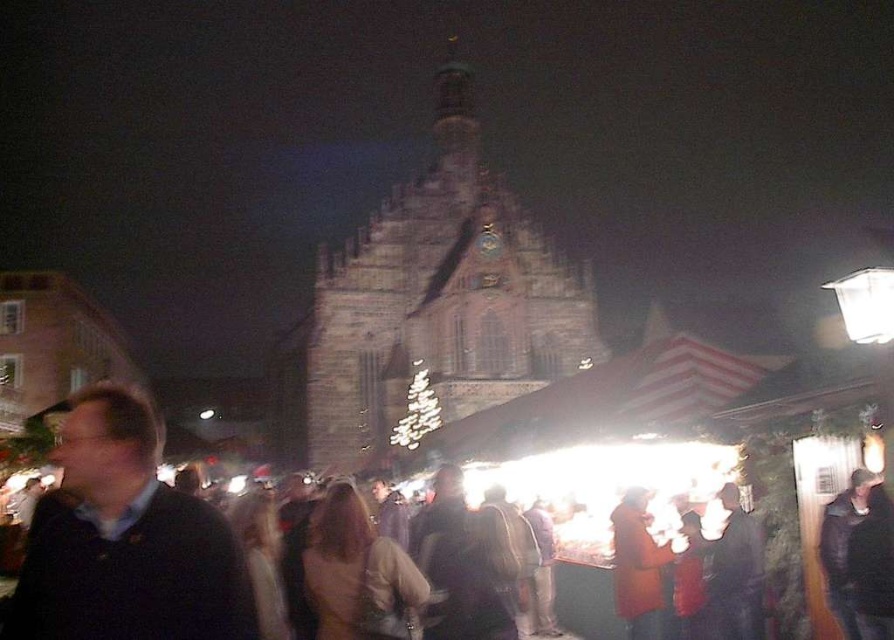
Question: Which of the following is the farthest from the observer?

Choices:
 (A) (881, 625)
 (B) (530, 243)

Answer: (B)

Question: Which object appears farthest from the camera in this image?

Choices:
 (A) dark brown leather jacket at lower right
 (B) dark stone church at center

Answer: (B)

Question: Does dark stone church at center appear over dark brown leather jacket at lower right?

Choices:
 (A) yes
 (B) no

Answer: (A)

Question: Which is farther from the dark blue sweater at left?

Choices:
 (A) dark stone church at center
 (B) dark brown leather jacket at lower right

Answer: (B)

Question: Is dark stone church at center to the left of dark blue sweater at left from the viewer's perspective?

Choices:
 (A) yes
 (B) no

Answer: (B)

Question: Can you confirm if dark blue sweater at left is bigger than dark brown leather jacket at lower right?

Choices:
 (A) yes
 (B) no

Answer: (A)